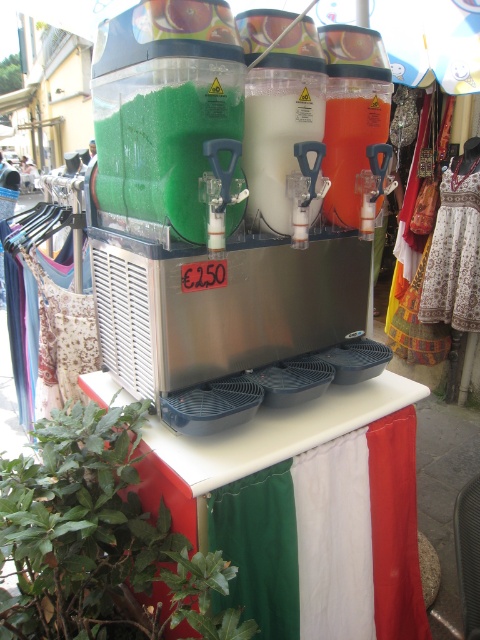
Question: Considering the real-world distances, which object is closest to the green translucent slush machine at center?

Choices:
 (A) green leafy plant at lower left
 (B) white plastic milkshake at center
 (C) white plastic table at center

Answer: (B)

Question: Can you confirm if green leafy plant at lower left is positioned above white plastic milkshake at center?

Choices:
 (A) no
 (B) yes

Answer: (A)

Question: Is green translucent slush machine at center thinner than white plastic milkshake at center?

Choices:
 (A) yes
 (B) no

Answer: (B)

Question: Based on their relative distances, which object is farther from the green translucent slush machine at center?

Choices:
 (A) white plastic table at center
 (B) white plastic milkshake at center

Answer: (A)

Question: Which of these objects is positioned closest to the green leafy plant at lower left?

Choices:
 (A) white plastic milkshake at center
 (B) white plastic table at center

Answer: (B)

Question: Is green translucent slush machine at center bigger than white plastic table at center?

Choices:
 (A) no
 (B) yes

Answer: (A)